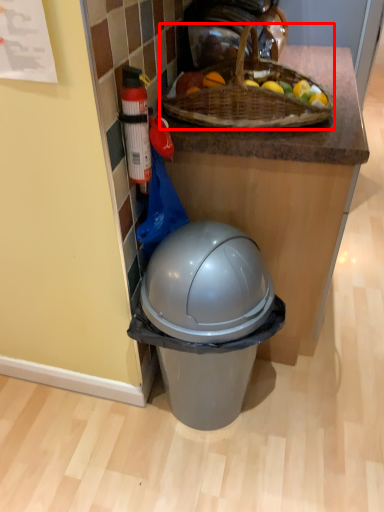
Question: From the image's perspective, where is picnic basket (annotated by the red box) located relative to bottle?

Choices:
 (A) below
 (B) above

Answer: (B)